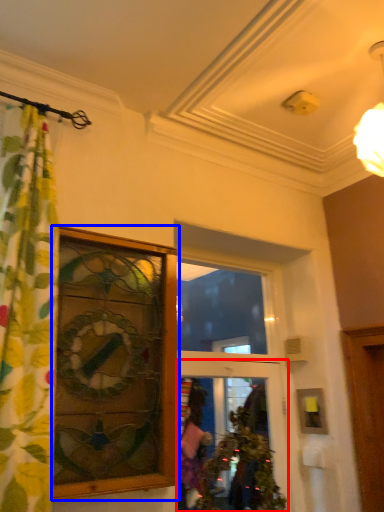
Question: Which of the following is the farthest to the observer, door (highlighted by a red box) or window (highlighted by a blue box)?

Choices:
 (A) door
 (B) window

Answer: (A)